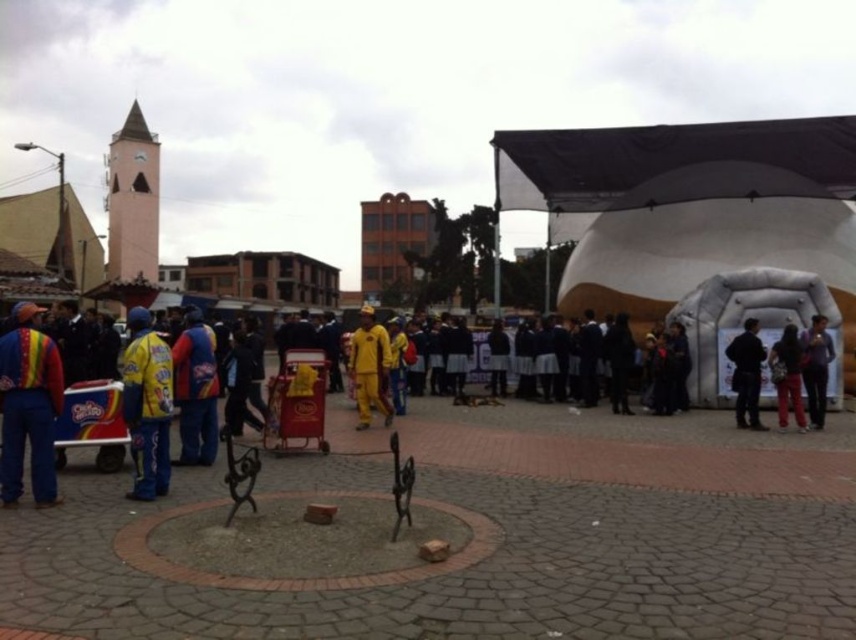
How much distance is there between rainbow striped vest at left and dark blue fabric jacket at right?

rainbow striped vest at left is 36.93 feet away from dark blue fabric jacket at right.

Is rainbow striped vest at left to the left of dark blue fabric jacket at right from the viewer's perspective?

Yes, rainbow striped vest at left is to the left of dark blue fabric jacket at right.

Where is `rainbow striped vest at left`? rainbow striped vest at left is located at coordinates (28, 406).

You are a GUI agent. You are given a task and a screenshot of the screen. Output one action in this format:
    pyautogui.click(x=<x>, y=<y>)
    Task: Click on the rainbow striped vest at left
    The image size is (856, 640).
    Given the screenshot: What is the action you would take?
    pyautogui.click(x=28, y=406)

Who is lower down, yellow fabric jacket at center or matte yellow jacket at left?

Positioned lower is yellow fabric jacket at center.

This screenshot has height=640, width=856. Find the location of `yellow fabric jacket at center`. yellow fabric jacket at center is located at coordinates (627, 451).

Locate an element on the screen. The height and width of the screenshot is (640, 856). yellow fabric jacket at center is located at coordinates (627, 451).

Who is positioned more to the right, yellow fabric jacket at left or black matte jacket at right?

From the viewer's perspective, black matte jacket at right appears more on the right side.

Does yellow fabric jacket at left have a greater width compared to black matte jacket at right?

Correct, the width of yellow fabric jacket at left exceeds that of black matte jacket at right.

Is point (141, 401) less distant than point (739, 388)?

Yes, it is in front of point (739, 388).

Find the location of `yellow fabric jacket at left`. yellow fabric jacket at left is located at coordinates (147, 404).